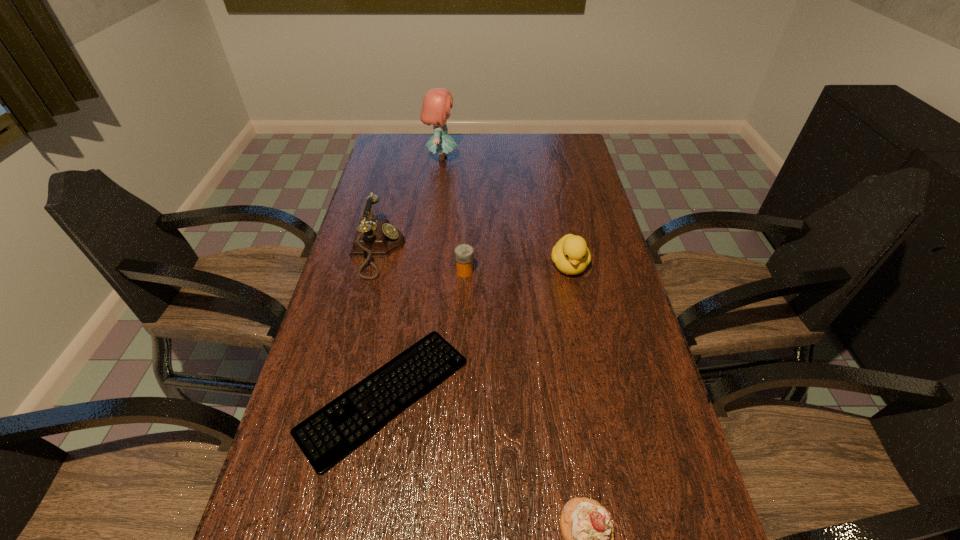
Locate an element on the screen. doll is located at coordinates (436, 106).

This screenshot has height=540, width=960. Find the location of `the farthest object`. the farthest object is located at coordinates (436, 106).

This screenshot has height=540, width=960. What are the coordinates of `telephone` in the screenshot? It's located at (375, 237).

Locate an element on the screen. This screenshot has height=540, width=960. duck is located at coordinates (571, 256).

The image size is (960, 540). I want to click on medicine, so click(x=464, y=253).

I want to click on the fifth farthest object, so click(328, 436).

Find the location of `computer keyboard`. computer keyboard is located at coordinates (328, 436).

Identify the location of vacant space located on the front-facing side of the farthest object. This screenshot has width=960, height=540. (556, 159).

At what (x,y) coordinates should I click in order to perform the action: click on vacant space located 0.140m on the dial of the telephone. Please return your answer as a coordinate pair (x, y). This screenshot has height=540, width=960. Looking at the image, I should click on (450, 251).

The width and height of the screenshot is (960, 540). Find the location of `vacant space situated on the front-facing side of the duck`. vacant space situated on the front-facing side of the duck is located at coordinates (599, 409).